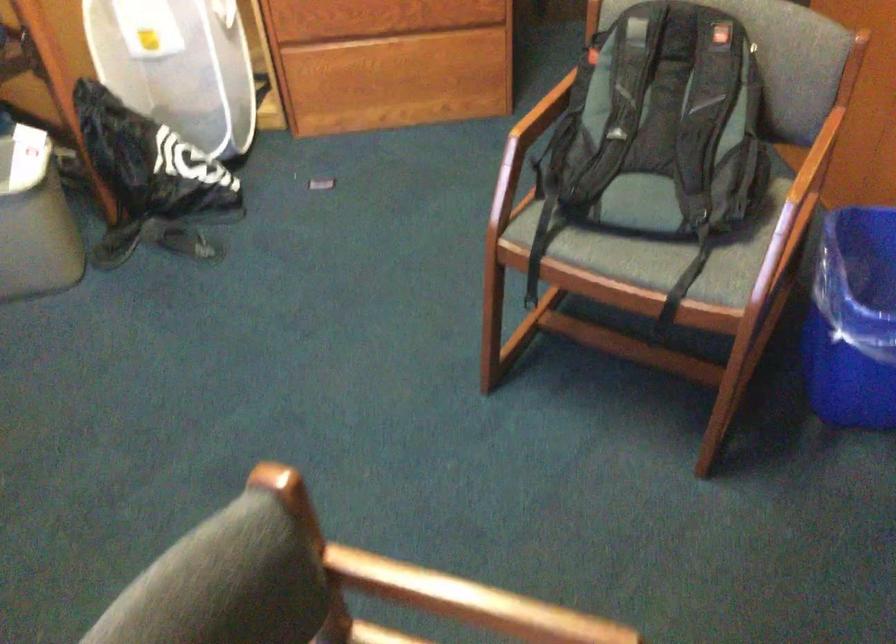
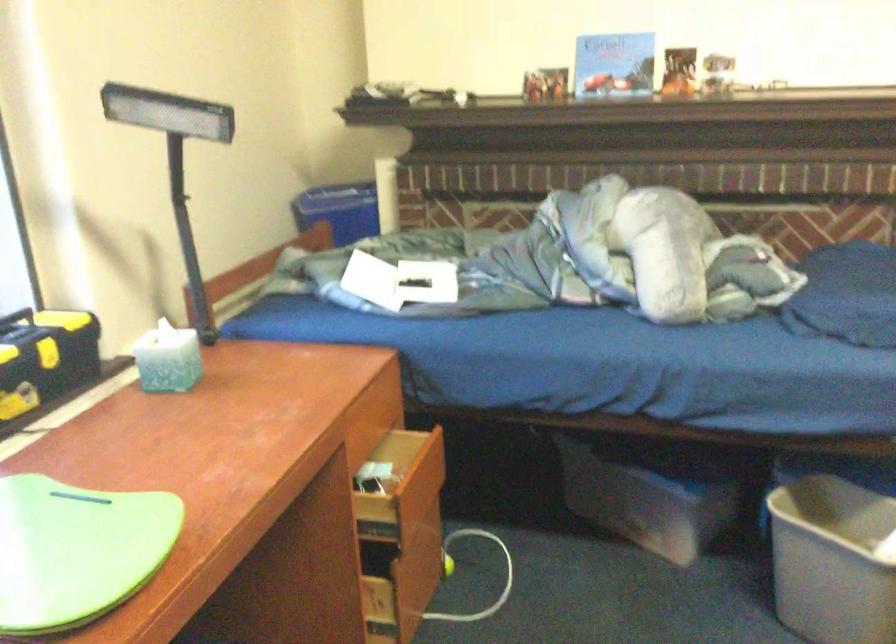
Question: How did the camera likely rotate?

Choices:
 (A) Left
 (B) Right
 (C) Up
 (D) Down

Answer: (A)